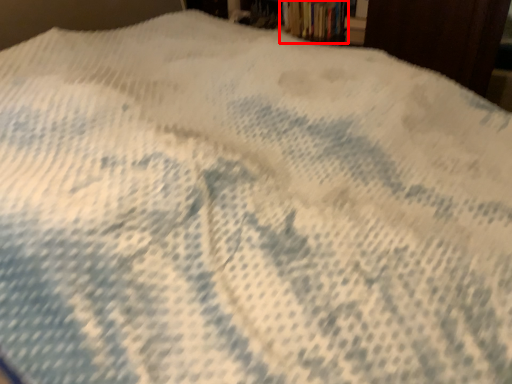
Question: From the image's perspective, what is the correct spatial relationship of book (annotated by the red box) in relation to paperback book?

Choices:
 (A) below
 (B) above

Answer: (B)